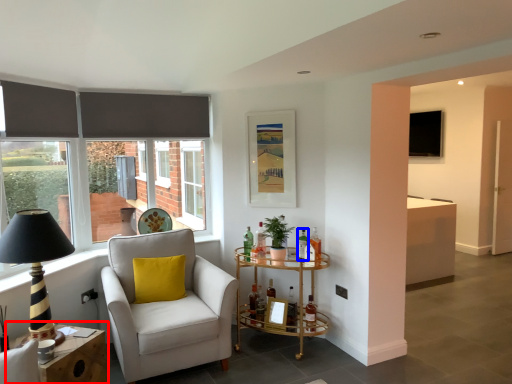
Question: Which object is further to the camera taking this photo, table (highlighted by a red box) or bottle (highlighted by a blue box)?

Choices:
 (A) table
 (B) bottle

Answer: (B)